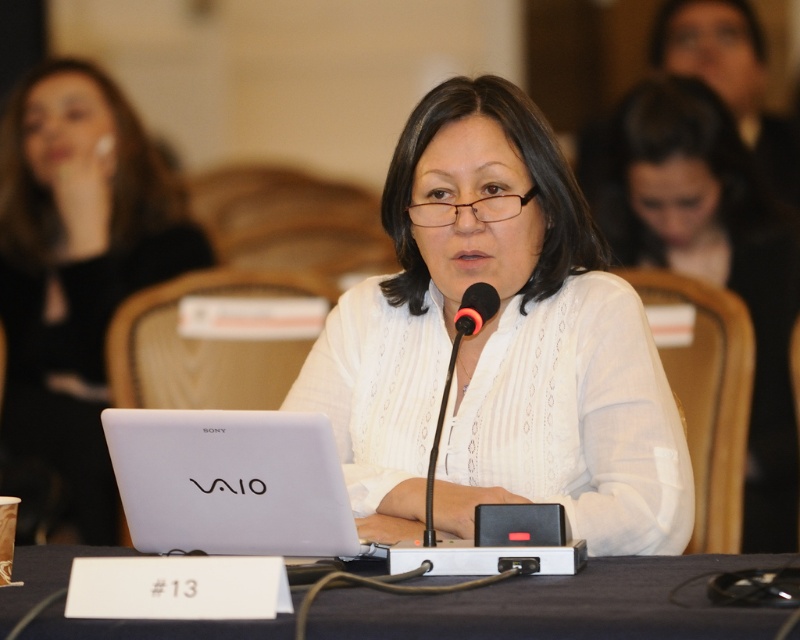
Based on the scene description, can you determine which object, the white fabric shirt at center or the black plastic table at center, is larger in size?

The white fabric shirt at center has a larger size compared to the black plastic table at center according to the description.

You are an event organizer setting up a presentation room. You have a matte white laptop at center and a black matte microphone at center on the table. Where should you place the nameplate so it doesn not block either item? Please choose between placing it to the left of the laptop, between the two items, or to the right of the microphone.

The matte white laptop at center is to the left of the black matte microphone at center. To avoid blocking either, place the nameplate to the right of the microphone or to the left of the laptop.